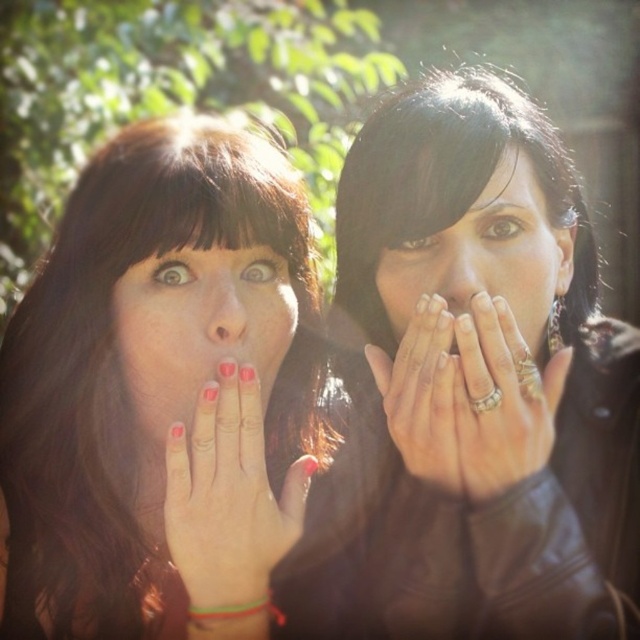
Between matte black jacket at center and smooth skin nose at center, which one appears on the right side from the viewer's perspective?

matte black jacket at center

The image size is (640, 640). What are the coordinates of `matte black jacket at center` in the screenshot? It's located at (474, 394).

This screenshot has width=640, height=640. I want to click on matte black jacket at center, so click(474, 394).

Is point (465, 371) positioned behind point (52, 620)?

That is False.

Is matte black jacket at center to the left of matte black hand at center from the viewer's perspective?

Incorrect, matte black jacket at center is not on the left side of matte black hand at center.

Which is behind, point (484, 346) or point (77, 621)?

The point (77, 621) is more distant.

I want to click on matte black jacket at center, so click(474, 394).

Is matte black hand at center behind matte red nails at center?

No, it is in front of matte red nails at center.

Does matte black hand at center have a greater width compared to matte red nails at center?

Correct, the width of matte black hand at center exceeds that of matte red nails at center.

What do you see at coordinates (160, 396) in the screenshot?
I see `matte black hand at center` at bounding box center [160, 396].

Locate an element on the screen. Image resolution: width=640 pixels, height=640 pixels. matte black hand at center is located at coordinates pyautogui.click(x=160, y=396).